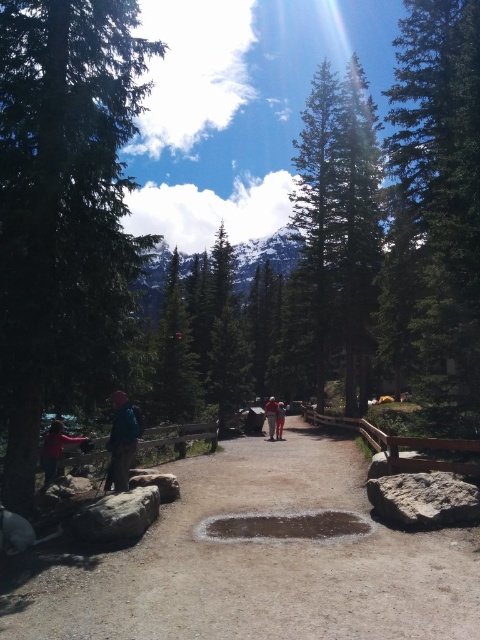
Question: Can you confirm if dirt path at center is positioned above green textured tree at right?

Choices:
 (A) yes
 (B) no

Answer: (B)

Question: Which object appears farthest from the camera in this image?

Choices:
 (A) green textured tree at right
 (B) light brown leather jacket at center
 (C) dirt path at center
 (D) blue fabric jacket at center

Answer: (B)

Question: Does matte pink jacket at lower left appear on the right side of orange fabric jacket at center?

Choices:
 (A) no
 (B) yes

Answer: (A)

Question: Among these objects, which one is farthest from the camera?

Choices:
 (A) dirt path at center
 (B) green textured tree at left

Answer: (B)

Question: Which point is closer to the camera?

Choices:
 (A) (118, 426)
 (B) (276, 412)
 (C) (365, 625)
 (D) (422, 241)

Answer: (C)

Question: Observing the image, what is the correct spatial positioning of green textured tree at left in reference to orange fabric jacket at center?

Choices:
 (A) left
 (B) right

Answer: (A)